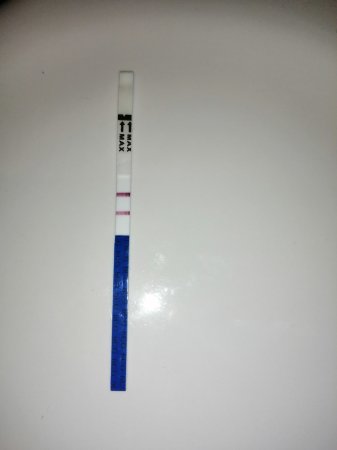
Identify the location of white surface. (264, 349).